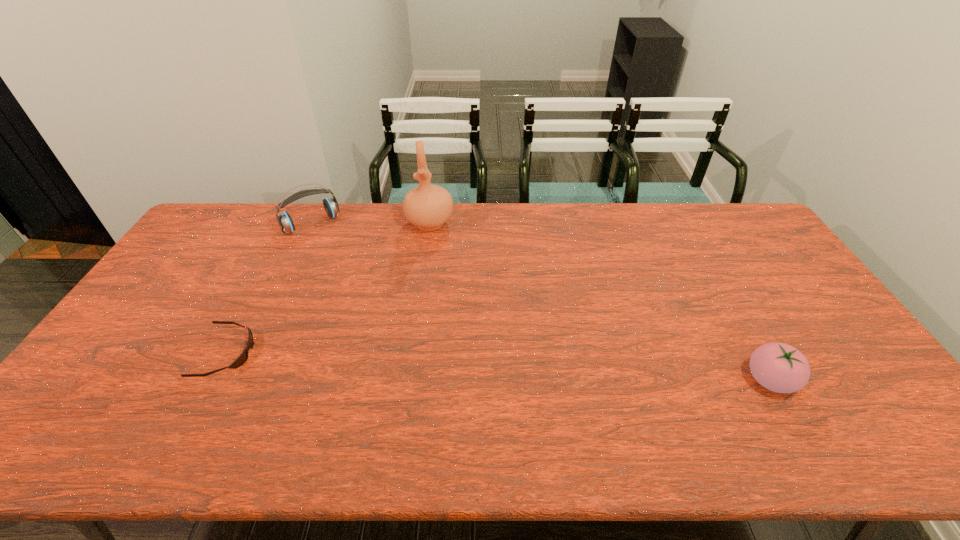
Locate an element on the screen. The height and width of the screenshot is (540, 960). vacant area situated on the ear cups of the headset is located at coordinates (365, 293).

At what (x,y) coordinates should I click in order to perform the action: click on free space located 0.350m on the spout of the tallest object. Please return your answer as a coordinate pair (x, y). This screenshot has width=960, height=540. Looking at the image, I should click on (433, 311).

Locate an element on the screen. The width and height of the screenshot is (960, 540). vacant region located on the spout of the tallest object is located at coordinates (433, 308).

The width and height of the screenshot is (960, 540). In order to click on free space located 0.070m on the spout of the tallest object in this screenshot , I will do `click(431, 250)`.

The height and width of the screenshot is (540, 960). I want to click on headset present at the far edge, so click(x=331, y=206).

The image size is (960, 540). What are the coordinates of `pottery located at the far edge` in the screenshot? It's located at coord(428,207).

Where is `sunglasses that is at the near edge`? The width and height of the screenshot is (960, 540). sunglasses that is at the near edge is located at coordinates 243,357.

Locate an element on the screen. The image size is (960, 540). tomato present at the near edge is located at coordinates (779, 367).

Locate an element on the screen. The image size is (960, 540). free space at the far edge of the desktop is located at coordinates (610, 216).

Where is `vacant space at the near edge of the desktop`? The image size is (960, 540). vacant space at the near edge of the desktop is located at coordinates (724, 394).